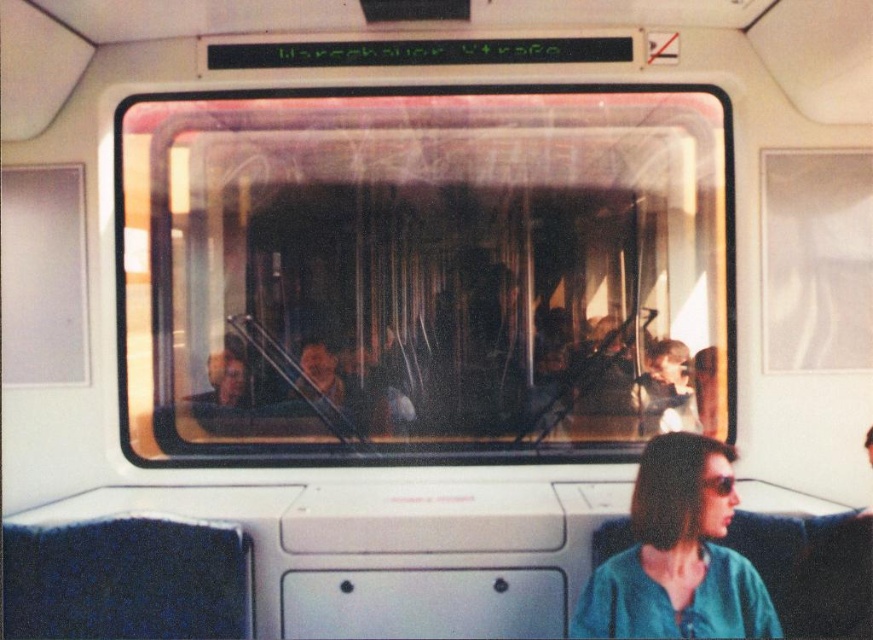
Is transparent glass train window at center to the right of teal fabric shirt at lower right from the viewer's perspective?

No, transparent glass train window at center is not to the right of teal fabric shirt at lower right.

Is transparent glass train window at center smaller than teal fabric shirt at lower right?

No, transparent glass train window at center is not smaller than teal fabric shirt at lower right.

Image resolution: width=873 pixels, height=640 pixels. Find the location of `transparent glass train window at center`. transparent glass train window at center is located at coordinates (423, 273).